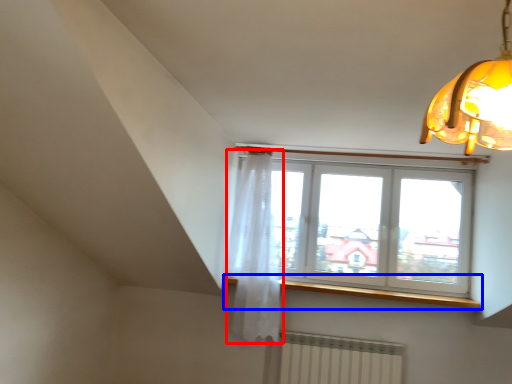
Question: Which of the following is the farthest to the observer, curtain (highlighted by a red box) or window sill (highlighted by a blue box)?

Choices:
 (A) curtain
 (B) window sill

Answer: (B)